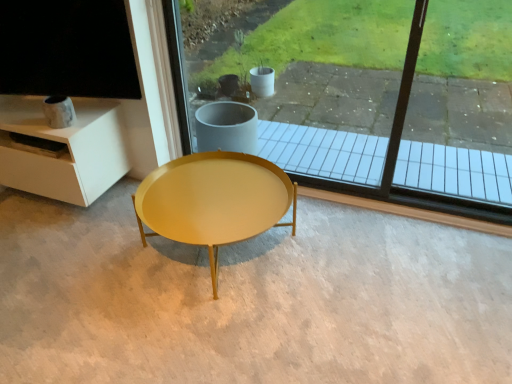
In order to click on vacant position to the left of matte yellow table at center in this screenshot , I will do `click(77, 262)`.